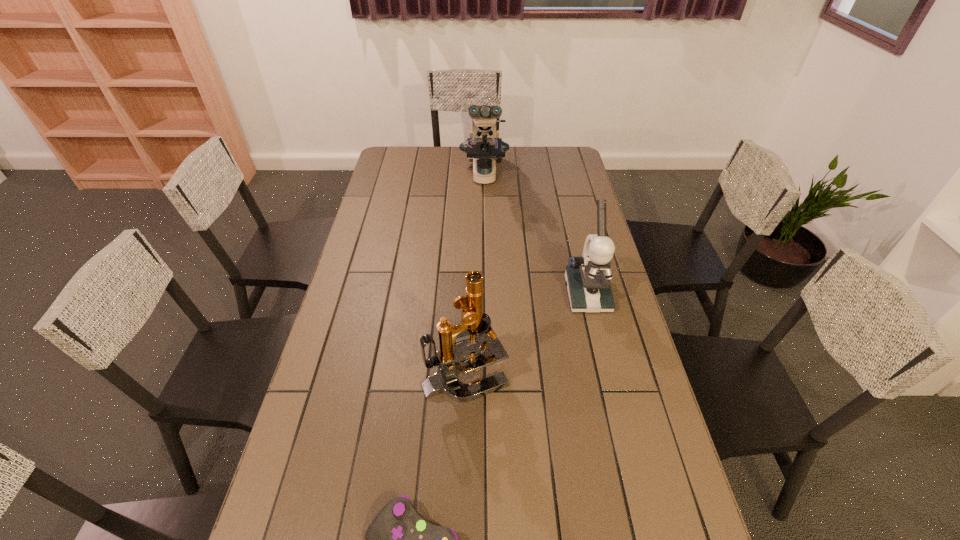
At what (x,y) coordinates should I click in order to perform the action: click on the farthest microscope. Please return your answer as a coordinate pair (x, y). Looking at the image, I should click on (484, 146).

Locate an element on the screen. Image resolution: width=960 pixels, height=540 pixels. the nearest microscope is located at coordinates (475, 326).

Find the location of a particular element. The width and height of the screenshot is (960, 540). the rightmost microscope is located at coordinates (588, 277).

Image resolution: width=960 pixels, height=540 pixels. Find the location of `the rightmost object`. the rightmost object is located at coordinates (588, 277).

You are a GUI agent. You are given a task and a screenshot of the screen. Output one action in this format:
    pyautogui.click(x=<x>, y=<y>)
    Task: Click on the vacant space located through the eyepieces of the farthest microscope
    The width and height of the screenshot is (960, 540).
    Given the screenshot: What is the action you would take?
    pyautogui.click(x=486, y=261)

The width and height of the screenshot is (960, 540). In order to click on free location located at the eyepiece of the second nearest object in this screenshot , I will do `click(636, 372)`.

Locate an element on the screen. The width and height of the screenshot is (960, 540). blank space located on the front of the second nearest microscope is located at coordinates (615, 409).

The image size is (960, 540). What are the coordinates of `object that is at the far edge` in the screenshot? It's located at (484, 146).

Find the location of a particular element. This screenshot has width=960, height=540. object that is positioned at the right edge is located at coordinates (588, 277).

This screenshot has height=540, width=960. In order to click on free space at the far edge of the desktop in this screenshot , I will do `click(516, 166)`.